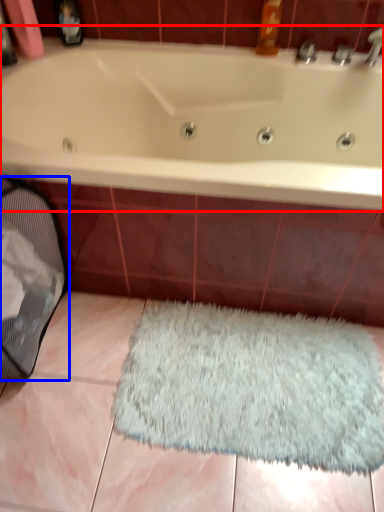
Question: Which object appears farthest to the camera in this image, bathtub (highlighted by a red box) or laundry basket (highlighted by a blue box)?

Choices:
 (A) bathtub
 (B) laundry basket

Answer: (A)